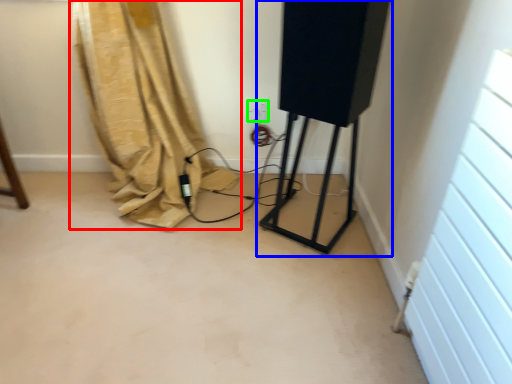
Question: Which is farther away from curtain (highlighted by a red box)? equipment (highlighted by a blue box) or electric outlet (highlighted by a green box)?

Choices:
 (A) equipment
 (B) electric outlet

Answer: (A)